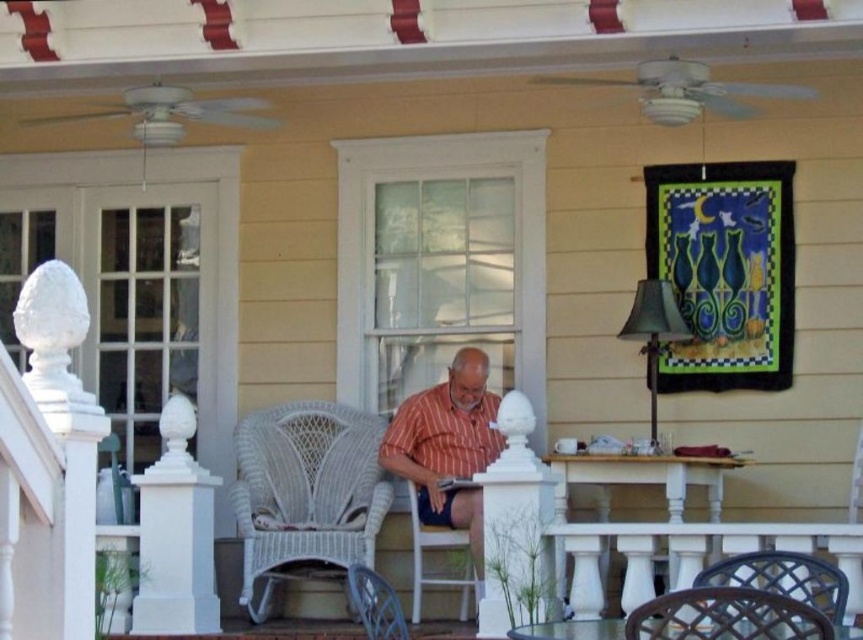
Question: Which point appears farthest from the camera in this image?

Choices:
 (A) coord(364,602)
 (B) coord(332,467)

Answer: (B)

Question: Which is nearer to the white wicker chair at center?

Choices:
 (A) white painted wood balustrade at lower center
 (B) brown woven chair at lower right

Answer: (A)

Question: Which point is farther to the camera?

Choices:
 (A) white painted wood balustrade at lower center
 (B) brown woven chair at lower right
 (C) wicker chair at lower center
 (D) striped cotton shirt at center

Answer: (D)

Question: Does white painted wood balustrade at lower center have a lesser width compared to white wicker chair at center?

Choices:
 (A) no
 (B) yes

Answer: (A)

Question: Is striped cotton shirt at center smaller than black woven chair at lower right?

Choices:
 (A) no
 (B) yes

Answer: (A)

Question: From the image, what is the correct spatial relationship of white wicker rocking chair at center in relation to white painted wood balustrade at lower center?

Choices:
 (A) left
 (B) right

Answer: (A)